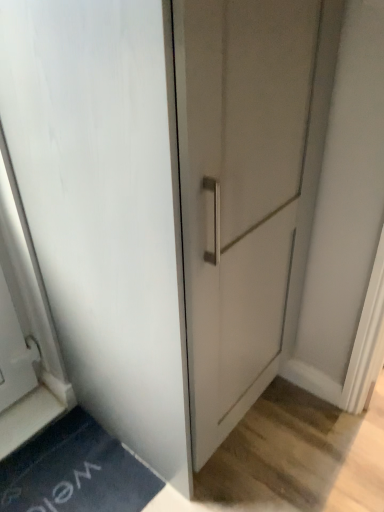
Question: Is point (16, 151) closer or farther from the camera than point (119, 444)?

Choices:
 (A) closer
 (B) farther

Answer: (A)

Question: In terms of size, does white matte door at center appear bigger or smaller than dark blue rubber bath mat at lower left?

Choices:
 (A) big
 (B) small

Answer: (A)

Question: Do you think white matte door at center is within dark blue rubber bath mat at lower left, or outside of it?

Choices:
 (A) inside
 (B) outside

Answer: (B)

Question: Considering the positions of point (84, 422) and point (21, 34), is point (84, 422) closer or farther from the camera than point (21, 34)?

Choices:
 (A) closer
 (B) farther

Answer: (B)

Question: Considering the positions of dark blue rubber bath mat at lower left and white matte door at center in the image, is dark blue rubber bath mat at lower left wider or thinner than white matte door at center?

Choices:
 (A) wide
 (B) thin

Answer: (B)

Question: From a real-world perspective, relative to white matte door at center, is dark blue rubber bath mat at lower left vertically above or below?

Choices:
 (A) below
 (B) above

Answer: (A)

Question: From the image's perspective, is dark blue rubber bath mat at lower left above or below white matte door at center?

Choices:
 (A) below
 (B) above

Answer: (A)